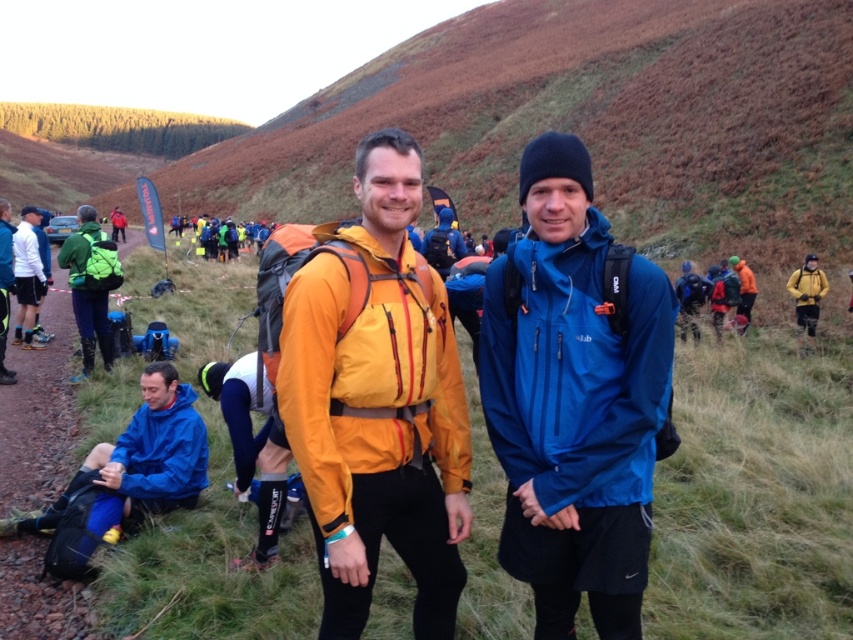
Question: Which point is farther from the camera taking this photo?

Choices:
 (A) (416, 600)
 (B) (517, 550)

Answer: (A)

Question: Does blue waterproof jacket at center have a greater width compared to matte yellow jacket at center?

Choices:
 (A) no
 (B) yes

Answer: (A)

Question: Is blue waterproof jacket at center positioned in front of blue matte jacket at lower left?

Choices:
 (A) no
 (B) yes

Answer: (B)

Question: Which object is positioned farthest from the blue waterproof jacket at center?

Choices:
 (A) blue matte jacket at lower left
 (B) matte yellow jacket at center

Answer: (A)

Question: Which object appears closest to the camera in this image?

Choices:
 (A) blue matte jacket at lower left
 (B) blue waterproof jacket at center
 (C) matte yellow jacket at center

Answer: (C)

Question: Does blue waterproof jacket at center have a smaller size compared to matte yellow jacket at center?

Choices:
 (A) yes
 (B) no

Answer: (A)